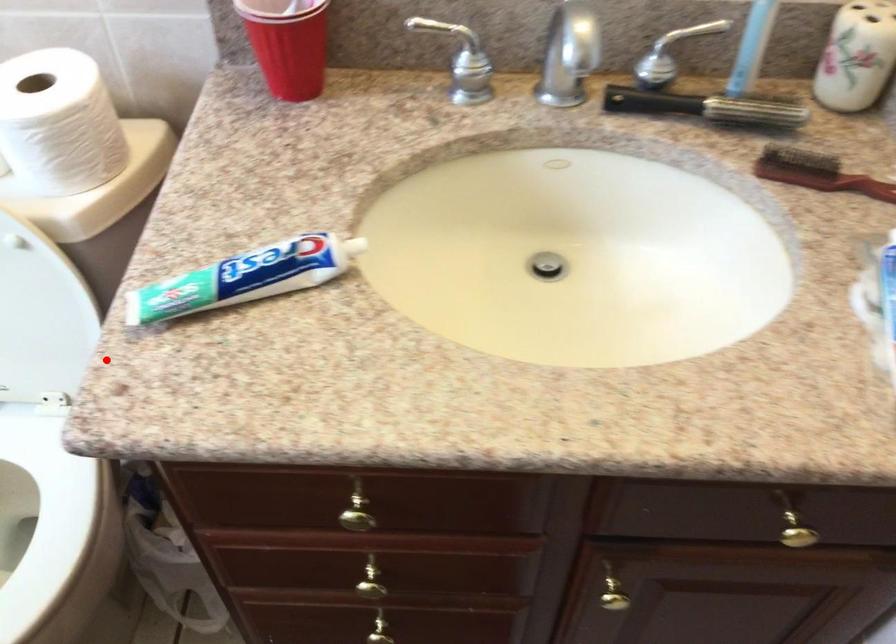
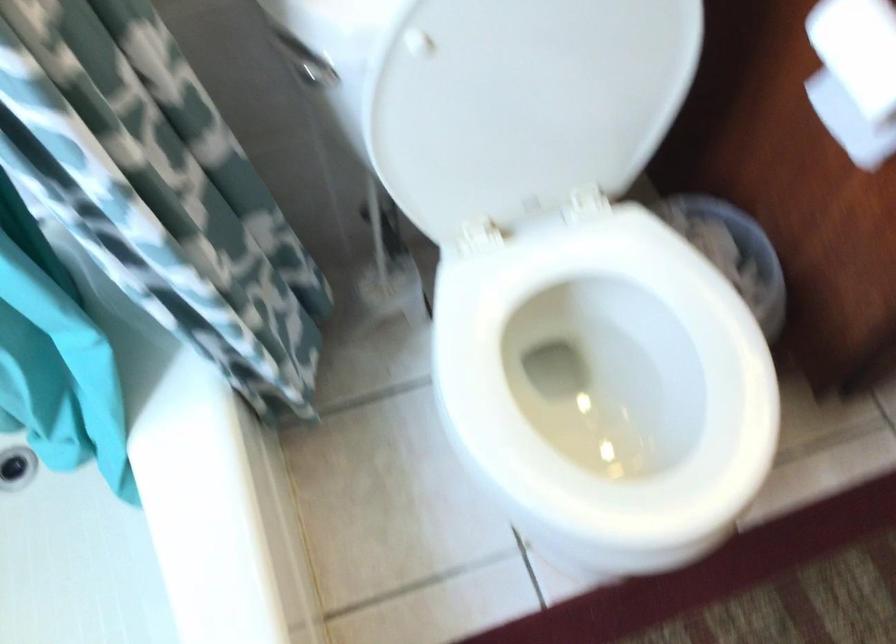
Question: A red point is marked in image1. In image2, is the corresponding 3D point closer to the camera or farther? Reply with the corresponding letter.

Choices:
 (A) The corresponding 3D point is closer.
 (B) The corresponding 3D point is farther.

Answer: (B)